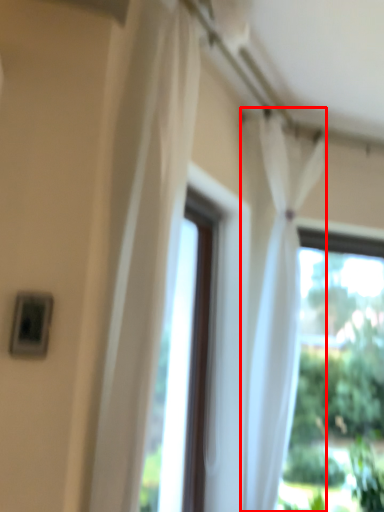
Question: From the image's perspective, considering the relative positions of curtain (annotated by the red box) and curtain in the image provided, where is curtain (annotated by the red box) located with respect to the staircase?

Choices:
 (A) above
 (B) below

Answer: (B)